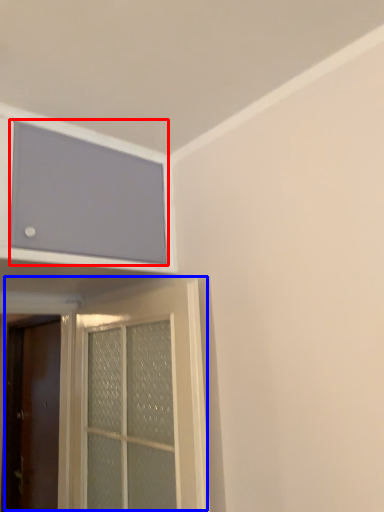
Question: Which of the following is the closest to the observer, window screen (highlighted by a red box) or door (highlighted by a blue box)?

Choices:
 (A) window screen
 (B) door

Answer: (A)